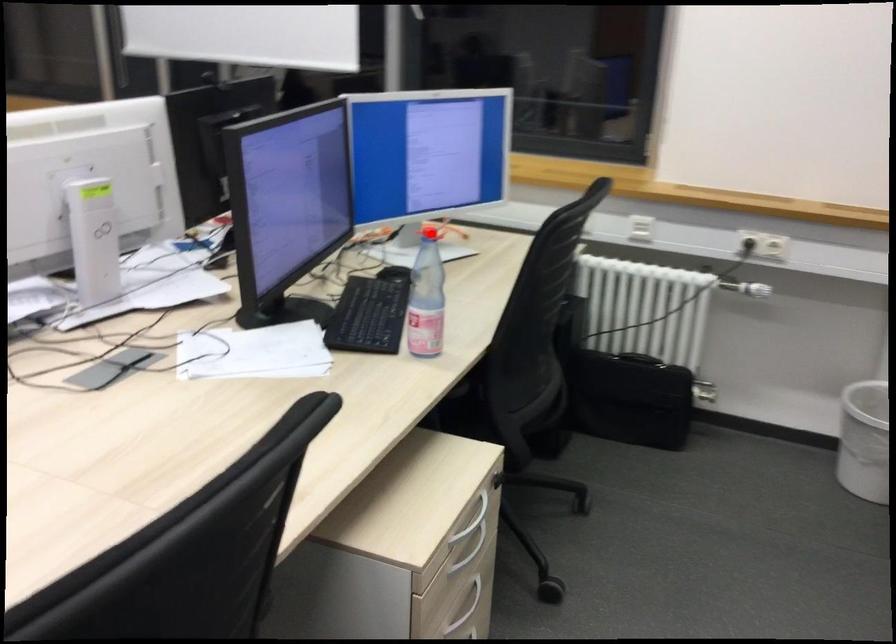
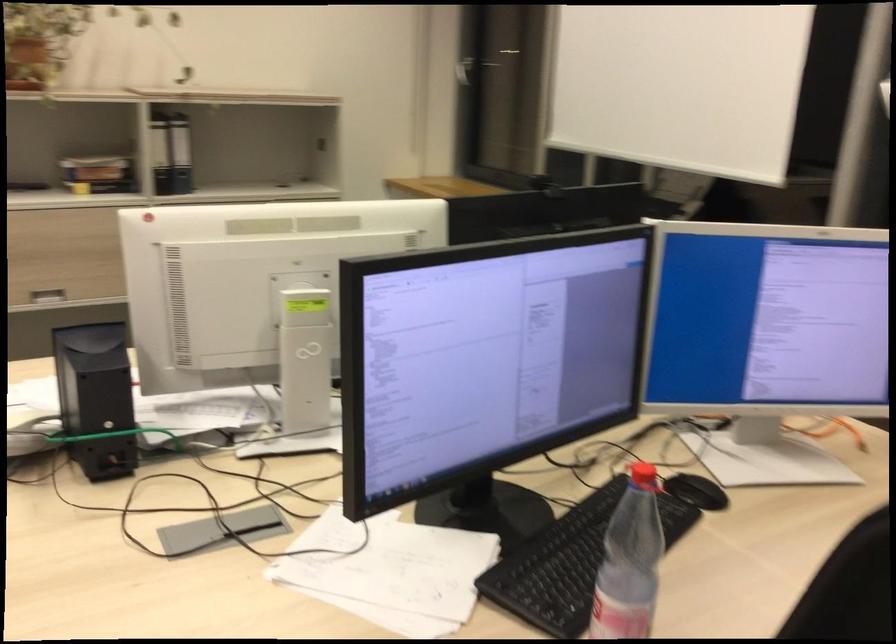
Question: A red point is marked in image1. In image2, is the corresponding 3D point closer to the camera or farther? Reply with the corresponding letter.

Choices:
 (A) The corresponding 3D point is closer.
 (B) The corresponding 3D point is farther.

Answer: (A)